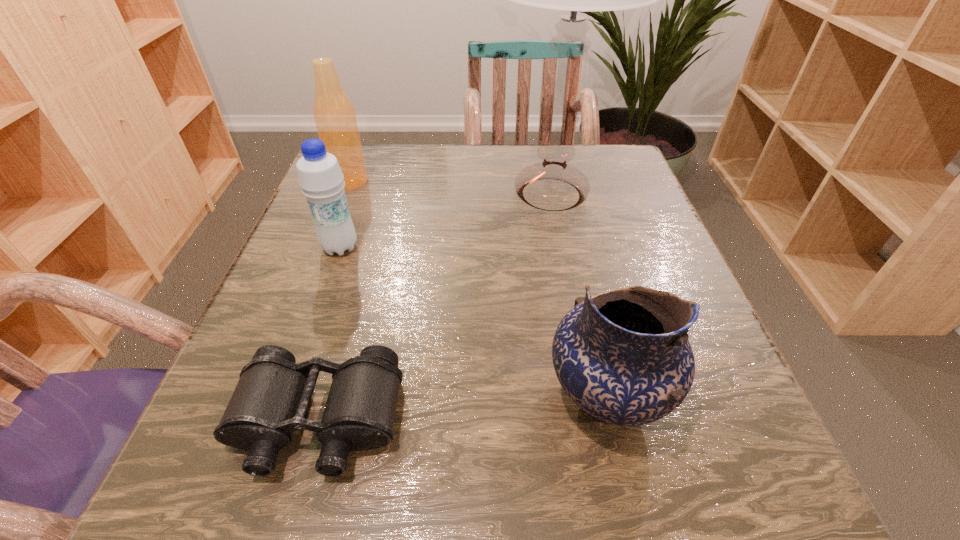
Identify which object is the fourth nearest to the pottery. Please provide its 2D coordinates. Your answer should be formatted as a tuple, i.e. [(x, y)], where the tuple contains the x and y coordinates of a point satisfying the conditions above.

[(334, 115)]

At what (x,y) coordinates should I click in order to perform the action: click on free space that satisfies the following two spatial constraints: 1. on the front-facing side of the tallest object; 2. on the left side of the pottery. Please return your answer as a coordinate pair (x, y). Image resolution: width=960 pixels, height=540 pixels. Looking at the image, I should click on (592, 397).

The image size is (960, 540). In order to click on free region that satisfies the following two spatial constraints: 1. on the front side of the pottery; 2. on the left side of the water bottle in this screenshot , I will do `click(287, 397)`.

Locate an element on the screen. free point that satisfies the following two spatial constraints: 1. on the front side of the pottery; 2. on the right side of the fourth shortest object is located at coordinates (265, 397).